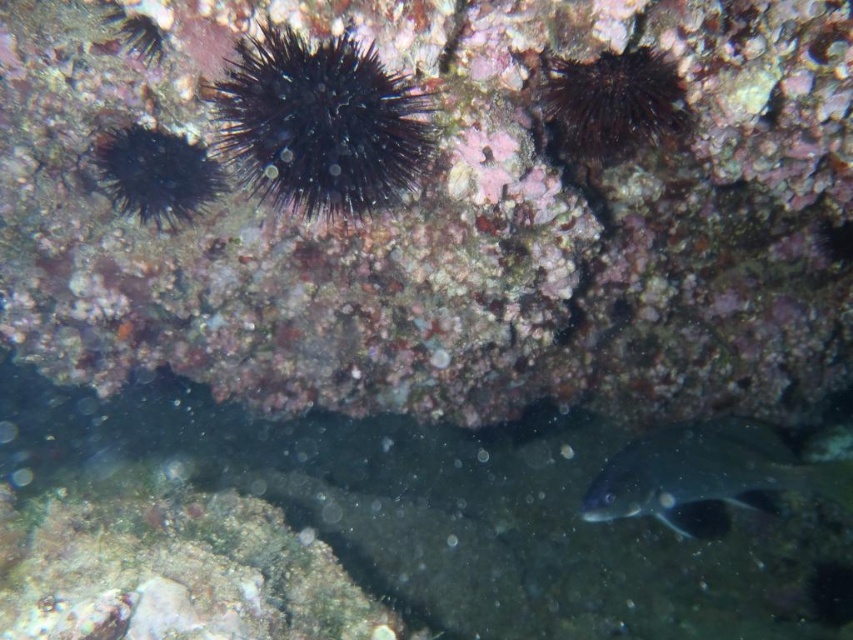
Can you confirm if black spiny at center is shorter than dark spiny sea urchin at upper right?

No.

Which of these two, black spiny at center or dark spiny sea urchin at upper right, stands shorter?

Standing shorter between the two is dark spiny sea urchin at upper right.

Image resolution: width=853 pixels, height=640 pixels. I want to click on black spiny at center, so click(318, 124).

Based on the photo, who is more distant from viewer, (x=296, y=148) or (x=148, y=132)?

Point (x=148, y=132)

Can you confirm if black spiny at center is positioned below black spiny at left?

Yes, black spiny at center is below black spiny at left.

Which is in front, point (328, 196) or point (105, 156)?

Point (328, 196)

The width and height of the screenshot is (853, 640). In order to click on black spiny at center in this screenshot , I will do `click(318, 124)`.

Find the location of a particular element. Image resolution: width=853 pixels, height=640 pixels. black spiny at center is located at coordinates (318, 124).

Where is `black spiny at center`? The width and height of the screenshot is (853, 640). black spiny at center is located at coordinates (x=318, y=124).

Find the location of `black spiny at center`. black spiny at center is located at coordinates (318, 124).